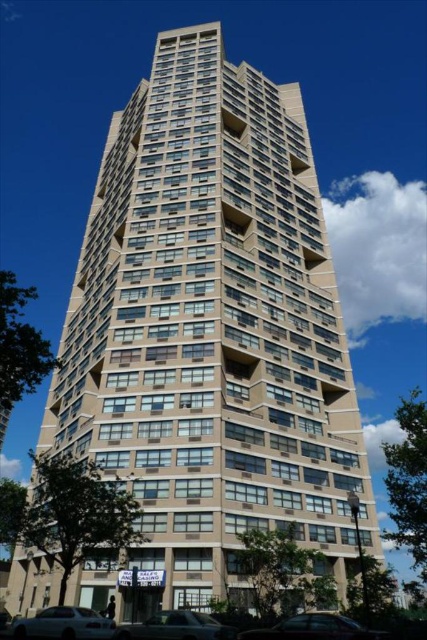
Measure the distance between point (43, 621) and camera.

Point (43, 621) and camera are 27.58 meters apart from each other.

Does silver metallic sedan at lower left appear on the left side of silver metallic sedan at lower center?

Indeed, silver metallic sedan at lower left is positioned on the left side of silver metallic sedan at lower center.

I want to click on silver metallic sedan at lower left, so click(63, 625).

Find the location of `silver metallic sedan at lower left`. silver metallic sedan at lower left is located at coordinates (63, 625).

Does silver metallic sedan at lower left have a greater height compared to metallic silver car at lower center?

Incorrect, silver metallic sedan at lower left's height is not larger of metallic silver car at lower center's.

Is silver metallic sedan at lower left above metallic silver car at lower center?

Yes, silver metallic sedan at lower left is above metallic silver car at lower center.

Where is `silver metallic sedan at lower left`? silver metallic sedan at lower left is located at coordinates (63, 625).

Is silver metallic sedan at lower center bigger than metallic silver car at lower center?

No, silver metallic sedan at lower center is not bigger than metallic silver car at lower center.

Is silver metallic sedan at lower center smaller than metallic silver car at lower center?

Indeed, silver metallic sedan at lower center has a smaller size compared to metallic silver car at lower center.

What do you see at coordinates (175, 627) in the screenshot?
I see `silver metallic sedan at lower center` at bounding box center [175, 627].

Identify the location of silver metallic sedan at lower center. (175, 627).